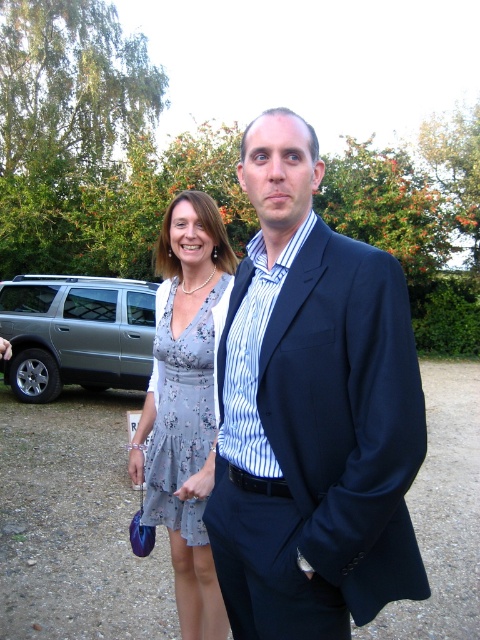
You are standing in a garden where two people are present. You notice a point marked at coordinates (312, 412). Which object from the scene is located exactly at this point?

The point at coordinates (312, 412) marks the location of the dark blue suit at center.

You are a photographer holding a camera. You want to take a photo of the dark blue suit at center from a distance of 1.5 meters. Is the camera currently positioned at the correct distance?

The camera and the dark blue suit at center are 1.27 meters apart, so the camera is positioned closer than the desired 1.5 meters. Move back 0.23 meters to achieve the correct distance.